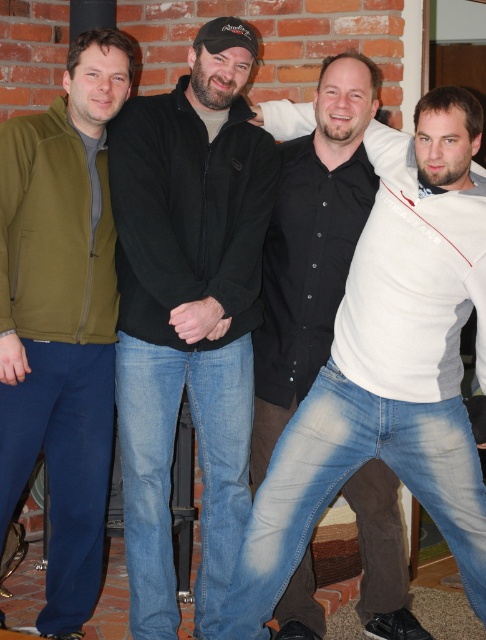
Question: Which point is farther to the camera?

Choices:
 (A) white matte shirt at center
 (B) olive green fleece jacket at left

Answer: (A)

Question: Which point is farther to the camera?

Choices:
 (A) white matte shirt at center
 (B) black matte jacket at center
 (C) olive green fleece jacket at left

Answer: (A)

Question: Among these objects, which one is farthest from the camera?

Choices:
 (A) white matte shirt at center
 (B) olive green fleece jacket at left
 (C) black matte jacket at center

Answer: (A)

Question: Does olive green fleece jacket at left appear under white matte shirt at center?

Choices:
 (A) no
 (B) yes

Answer: (B)

Question: Is black matte jacket at center wider than olive green fleece jacket at left?

Choices:
 (A) yes
 (B) no

Answer: (A)

Question: Can you confirm if black matte jacket at center is thinner than white matte shirt at center?

Choices:
 (A) yes
 (B) no

Answer: (B)